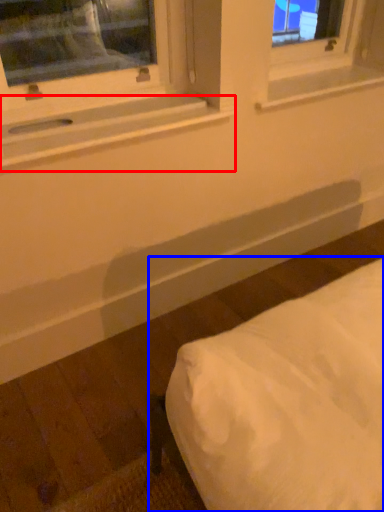
Question: Which object is closer to the camera taking this photo, window sill (highlighted by a red box) or furniture (highlighted by a blue box)?

Choices:
 (A) window sill
 (B) furniture

Answer: (B)